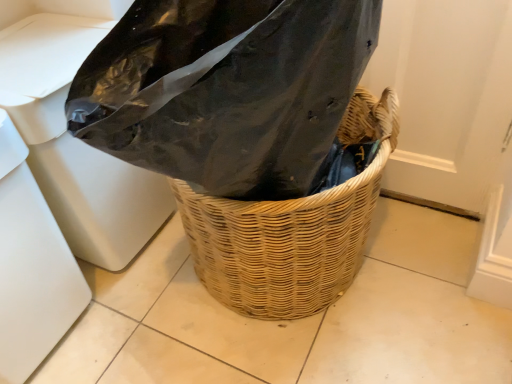
Find the location of a particular element. The image size is (512, 384). woven wood basket at center is located at coordinates (292, 230).

The image size is (512, 384). What do you see at coordinates (292, 230) in the screenshot?
I see `woven wood basket at center` at bounding box center [292, 230].

Image resolution: width=512 pixels, height=384 pixels. In order to click on woven wood basket at center in this screenshot , I will do `click(292, 230)`.